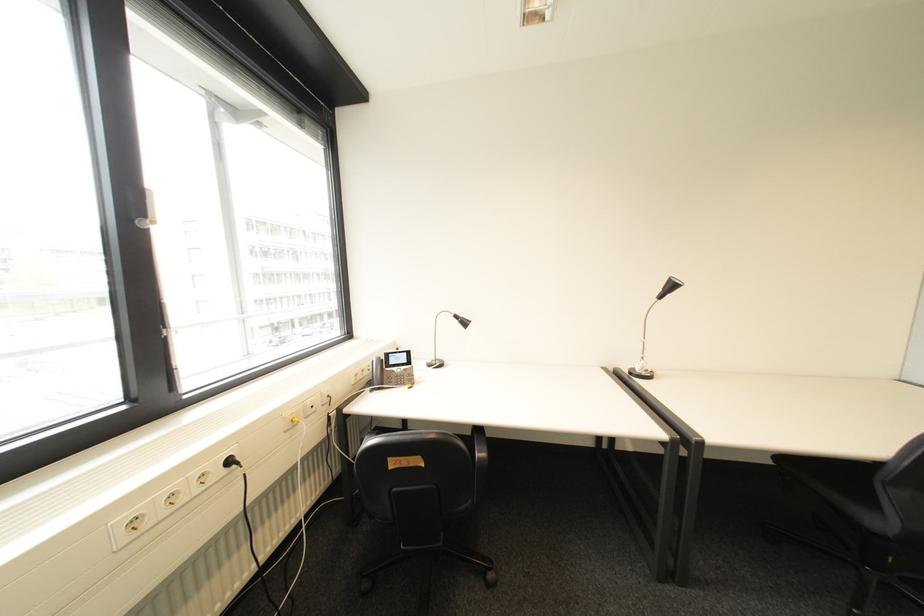
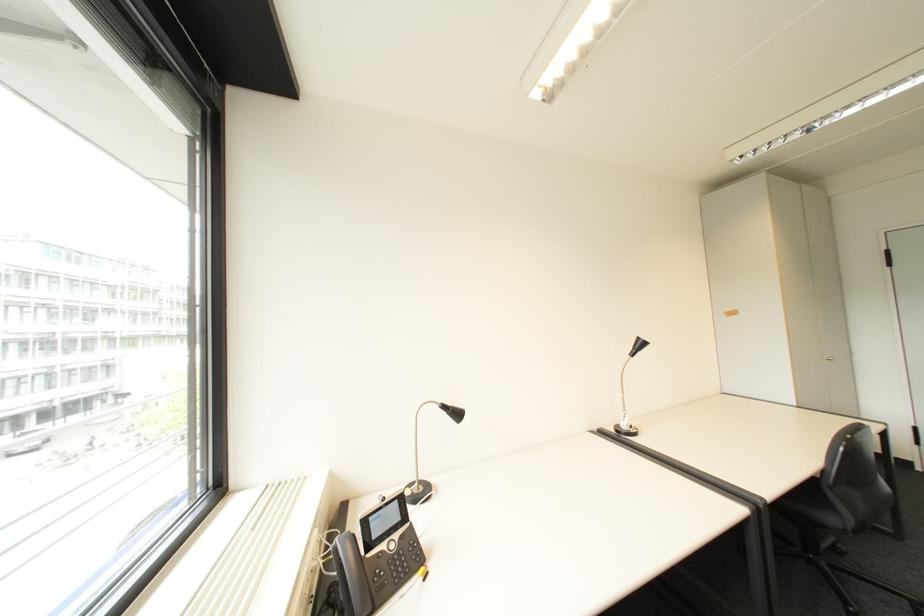
Question: The camera is either moving clockwise (left) or counter-clockwise (right) around the object. The first image is from the beginning of the video and the second image is from the end. Is the camera moving left or right when shooting the video?

Choices:
 (A) Left
 (B) Right

Answer: (A)